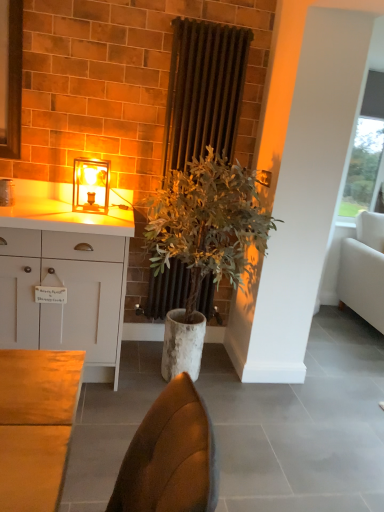
Question: From the image's perspective, is green leafy plant at center positioned above or below matte glass table lamp at upper left?

Choices:
 (A) above
 (B) below

Answer: (B)

Question: Is green leafy plant at center wider or thinner than matte glass table lamp at upper left?

Choices:
 (A) thin
 (B) wide

Answer: (B)

Question: Estimate the real-world distances between objects in this image. Which object is farther from the matte glass table lamp at upper left?

Choices:
 (A) white matte cabinet at left
 (B) dark brown radiator at center
 (C) green leafy plant at center
 (D) white fabric couch at right

Answer: (D)

Question: Considering the real-world distances, which object is farthest from the dark brown radiator at center?

Choices:
 (A) matte glass table lamp at upper left
 (B) white matte cabinet at left
 (C) green leafy plant at center
 (D) white fabric couch at right

Answer: (D)